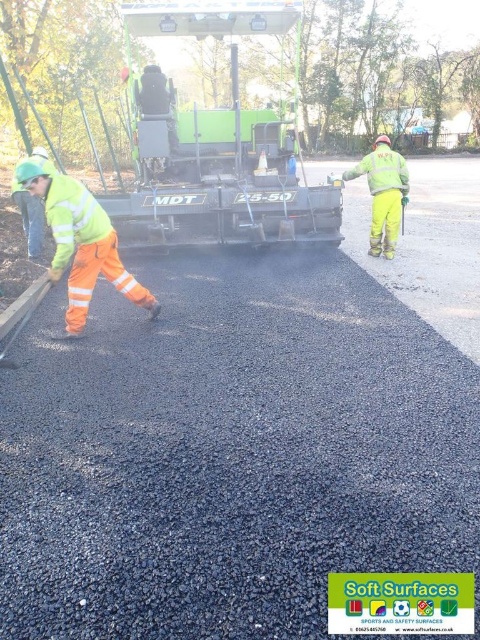
You are a construction supervisor observing the road construction site. You notice a point marked at coordinates (216, 145). What object is located at that point?

The point at coordinates (216, 145) marks the green rubber asphalt spreader at center.